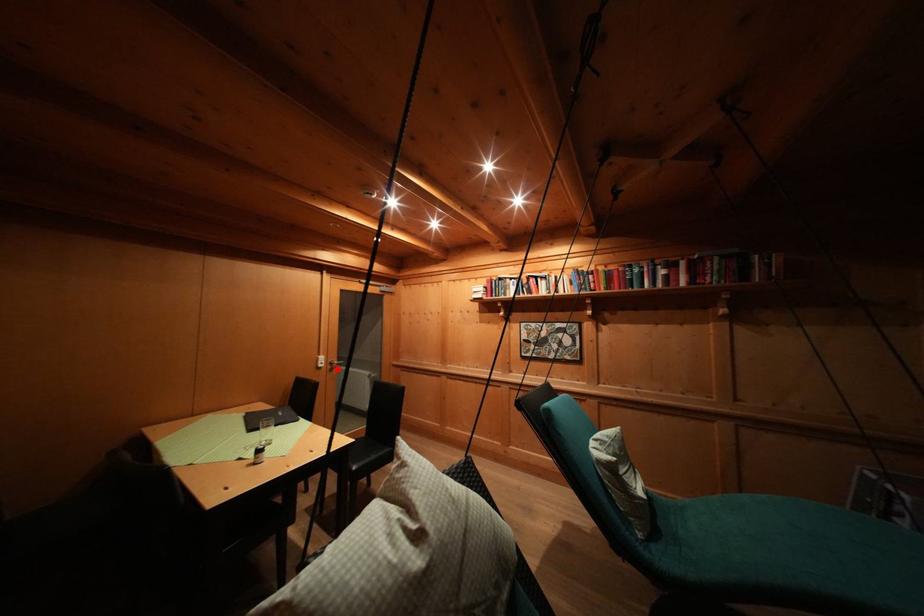
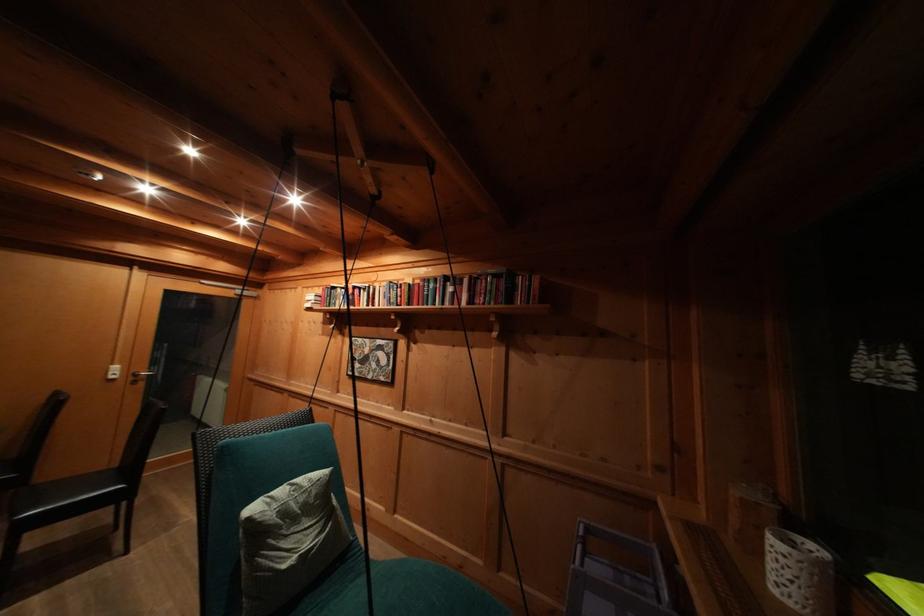
Question: I am providing you with two images of the same scene from different viewpoints. In image1, a red point is highlighted. Considering the same 3D point in image2, which of the following is correct?

Choices:
 (A) It is closer
 (B) It is farther

Answer: (A)